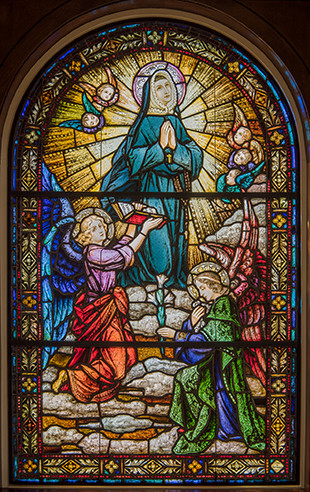
Locate an element on the screen. leg is located at coordinates (64, 374).